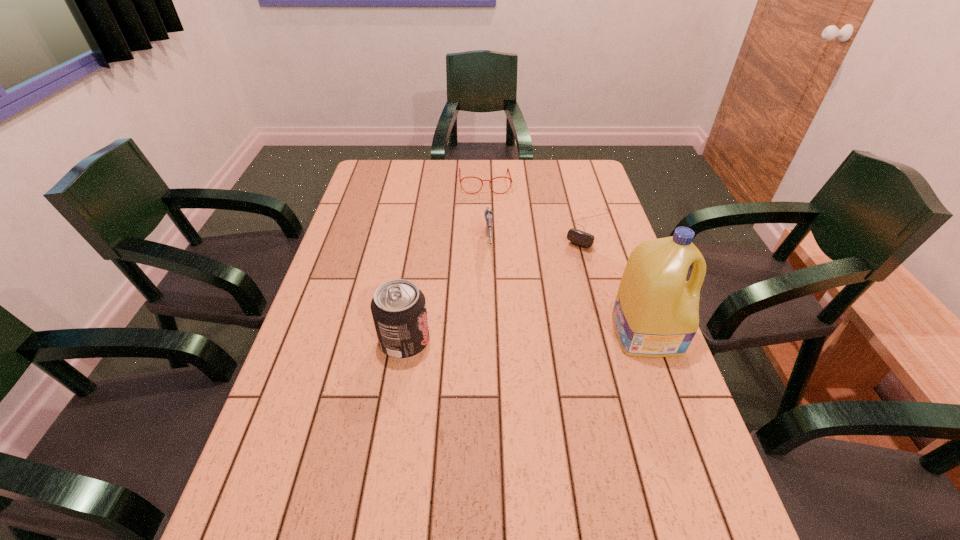
Image resolution: width=960 pixels, height=540 pixels. What are the coordinates of `the leftmost object` in the screenshot? It's located at (398, 307).

Find the location of a particular element. This screenshot has height=540, width=960. the second tallest object is located at coordinates (398, 307).

You are a GUI agent. You are given a task and a screenshot of the screen. Output one action in this format:
    pyautogui.click(x=<x>, y=<y>)
    Task: Click on the tallest object
    
    Given the screenshot: What is the action you would take?
    pyautogui.click(x=656, y=313)

Where is `the shortest object`? This screenshot has height=540, width=960. the shortest object is located at coordinates (581, 238).

Find the location of a particular element. The image size is (960, 540). the farthest object is located at coordinates (460, 180).

Where is `the fourth tallest object`? This screenshot has height=540, width=960. the fourth tallest object is located at coordinates (460, 180).

At what (x,y) coordinates should I click in order to perform the action: click on the third tallest object. Please return your answer as a coordinate pair (x, y). The image size is (960, 540). Looking at the image, I should click on (488, 213).

Image resolution: width=960 pixels, height=540 pixels. I want to click on free region located on the front of the second tallest object, so click(391, 433).

Locate an element on the screen. vacant space located 0.190m on the front-facing side of the shortest object is located at coordinates (553, 286).

Find the location of a particular element. free region located 0.070m on the front-facing side of the shortest object is located at coordinates (570, 262).